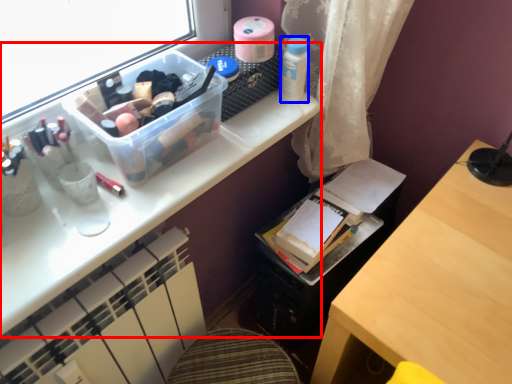
Question: Which point is further to the camera, desk (highlighted by a red box) or toiletry (highlighted by a blue box)?

Choices:
 (A) desk
 (B) toiletry

Answer: (B)